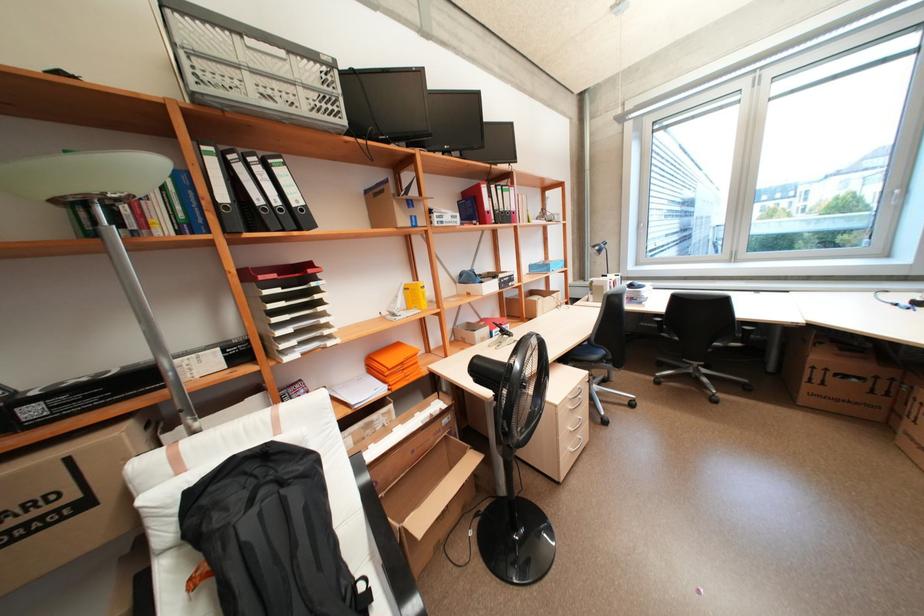
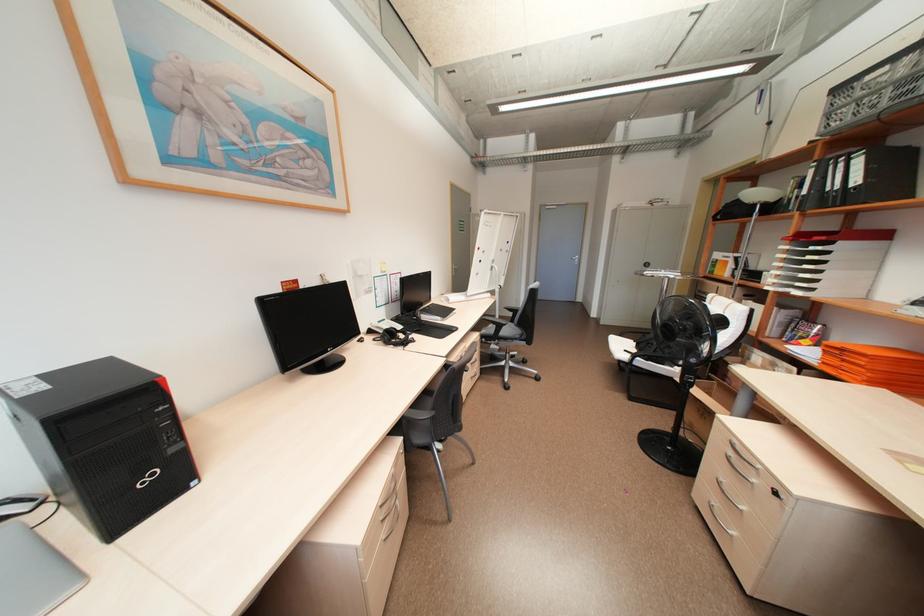
In the second image, find the point that corresponds to (x=228, y=197) in the first image.

(810, 191)